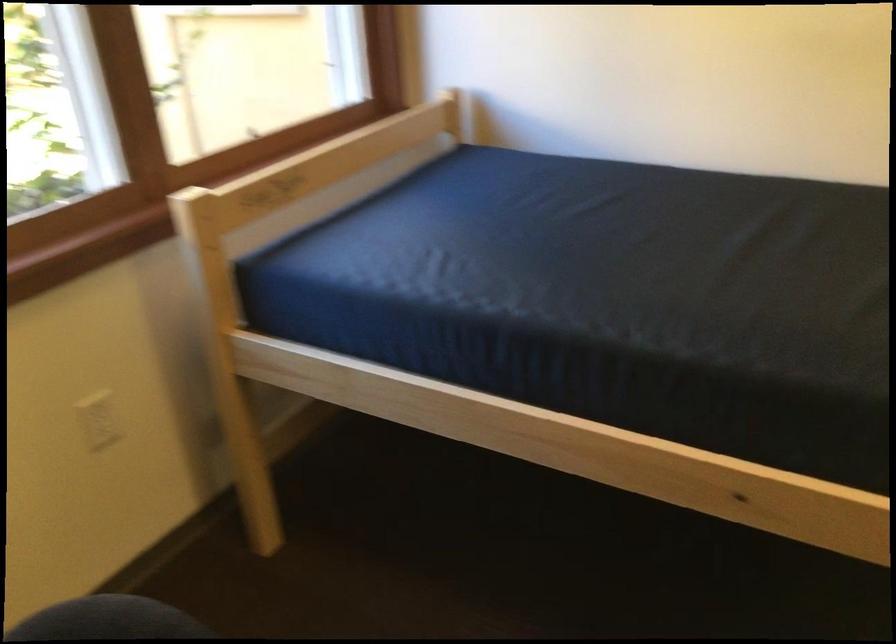
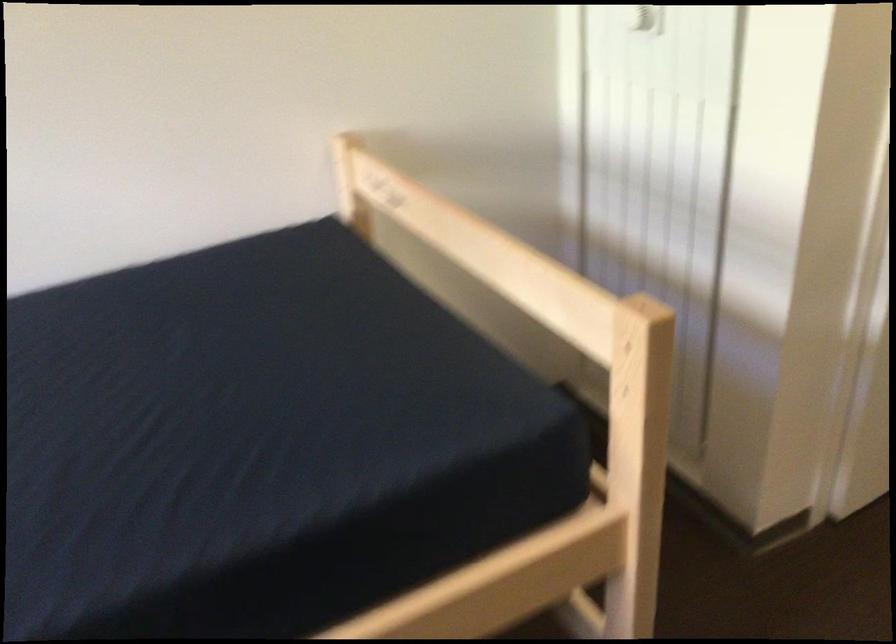
Question: The camera is either moving clockwise (left) or counter-clockwise (right) around the object. The first image is from the beginning of the video and the second image is from the end. Is the camera moving left or right when shooting the video?

Choices:
 (A) Left
 (B) Right

Answer: (A)